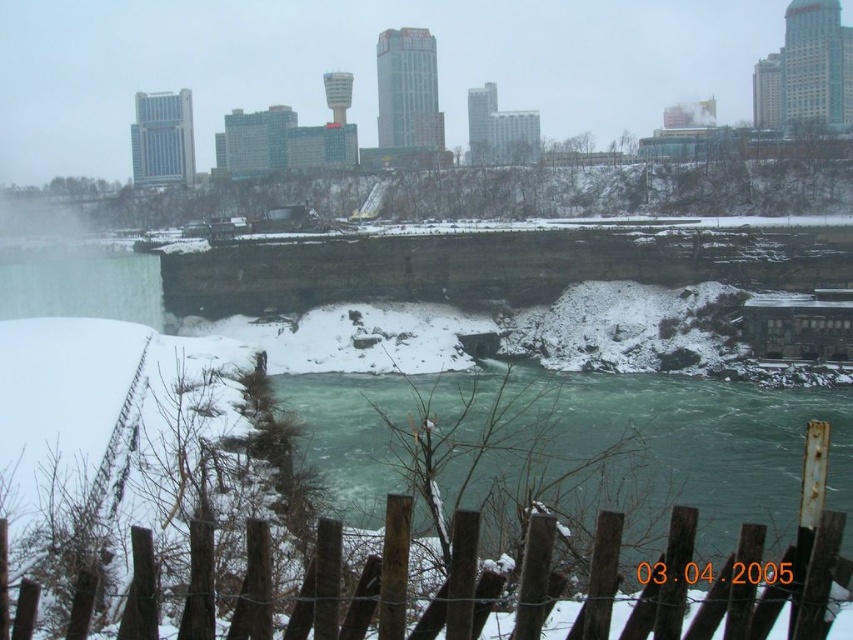
Question: Can you confirm if green frothy water at center is bigger than wooden fence at lower center?

Choices:
 (A) yes
 (B) no

Answer: (A)

Question: Is green frothy water at center to the right of wooden fence at lower center from the viewer's perspective?

Choices:
 (A) yes
 (B) no

Answer: (A)

Question: Which point is closer to the camera?

Choices:
 (A) wooden fence at lower center
 (B) green frothy water at center

Answer: (A)

Question: Does green frothy water at center lie behind wooden fence at lower center?

Choices:
 (A) yes
 (B) no

Answer: (A)

Question: Which of the following is the farthest from the observer?

Choices:
 (A) (461, 422)
 (B) (595, 586)

Answer: (A)